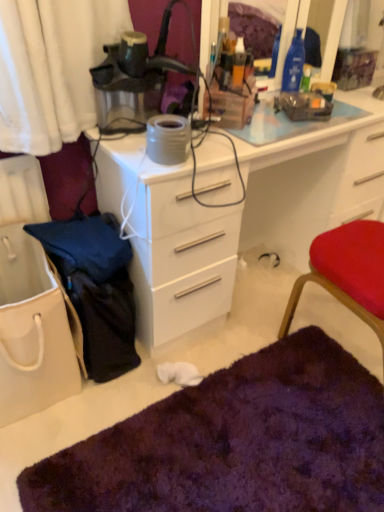
The image size is (384, 512). In order to click on unoccupied region to the right of matte black lamp at upper center in this screenshot , I will do `click(214, 142)`.